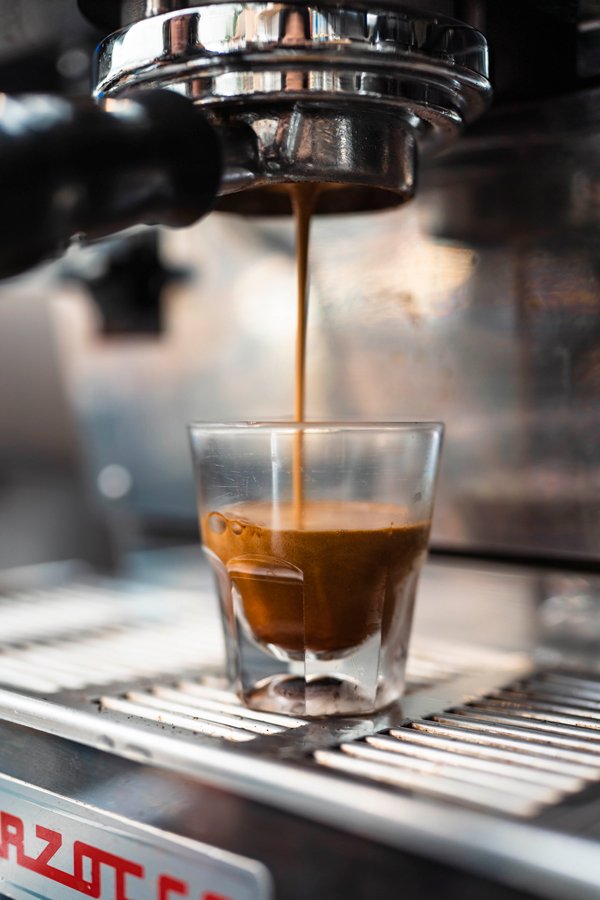
Locate an element on the screen. Image resolution: width=600 pixels, height=900 pixels. glass is located at coordinates (350, 490).